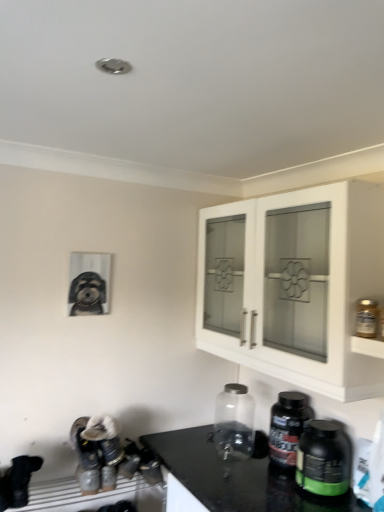
This screenshot has height=512, width=384. Describe the element at coordinates (323, 459) in the screenshot. I see `green matte protein powder container at lower right, the 3th bottle in the back-to-front sequence` at that location.

Image resolution: width=384 pixels, height=512 pixels. In order to click on white glass cabinet at upper right in this screenshot , I will do pyautogui.click(x=307, y=289).

Which is farther, (366,320) or (83,301)?

The point (83,301) is behind.

Who is more distant, clear glass jar at upper right, the 1th bottle positioned from the front, or matte black dog at left?

matte black dog at left.

Locate an element on the screen. dog located on the left of clear glass jar at upper right, the 1th bottle positioned from the front is located at coordinates (87, 294).

Is matte black dog at left surrounded by clear glass jar at upper right, placed as the fourth bottle when sorted from back to front?

No, matte black dog at left is not surrounded by clear glass jar at upper right, placed as the fourth bottle when sorted from back to front.

Would you consider green matte protein powder container at lower right, the 3th bottle in the back-to-front sequence, to be distant from clear glass jar at upper right, placed as the fourth bottle when sorted from back to front?

No.

Does green matte protein powder container at lower right, the 3th bottle in the back-to-front sequence, have a greater height compared to clear glass jar at upper right, placed as the fourth bottle when sorted from back to front?

Yes.

This screenshot has width=384, height=512. Identify the location of bottle located in front of the green matte protein powder container at lower right, the 3th bottle in the back-to-front sequence. (366, 318).

How different are the orientations of matte black dog at left and green matte protein powder container at lower right, the 2th bottle in the front-to-back sequence, in degrees?

The angular difference between matte black dog at left and green matte protein powder container at lower right, the 2th bottle in the front-to-back sequence, is 90.5 degrees.

Which of these two, matte black dog at left or green matte protein powder container at lower right, the 2th bottle in the front-to-back sequence, stands taller?

With more height is matte black dog at left.

Consider the image. From the image's perspective, does matte black dog at left appear lower than green matte protein powder container at lower right, the 2th bottle in the front-to-back sequence?

No, from the image's perspective, matte black dog at left is not below green matte protein powder container at lower right, the 2th bottle in the front-to-back sequence.

Is matte black dog at left wider or thinner than green matte protein powder container at lower right, the 3th bottle in the back-to-front sequence?

Considering their sizes, matte black dog at left looks slimmer than green matte protein powder container at lower right, the 3th bottle in the back-to-front sequence.

Who is shorter, white glass cabinet at upper right or transparent glass jar at center, the fourth bottle viewed from the front?

Standing shorter between the two is transparent glass jar at center, the fourth bottle viewed from the front.

Looking at their sizes, would you say white glass cabinet at upper right is wider or thinner than transparent glass jar at center, the fourth bottle viewed from the front?

Clearly, white glass cabinet at upper right has more width compared to transparent glass jar at center, the fourth bottle viewed from the front.

What's the angular difference between white glass cabinet at upper right and transparent glass jar at center, acting as the 1th bottle starting from the back,'s facing directions?

There is a 1.22-degree angle between the facing directions of white glass cabinet at upper right and transparent glass jar at center, acting as the 1th bottle starting from the back.

Is white glass cabinet at upper right positioned far away from transparent glass jar at center, acting as the 1th bottle starting from the back?

That's not correct — white glass cabinet at upper right is a little close to transparent glass jar at center, acting as the 1th bottle starting from the back.

From a real-world perspective, relative to white glass cabinet at upper right, is green matte protein powder container at lower right, the 3th bottle in the back-to-front sequence, vertically above or below?

green matte protein powder container at lower right, the 3th bottle in the back-to-front sequence, is situated lower than white glass cabinet at upper right in the real world.

Who is shorter, green matte protein powder container at lower right, the 3th bottle in the back-to-front sequence, or white glass cabinet at upper right?

Standing shorter between the two is green matte protein powder container at lower right, the 3th bottle in the back-to-front sequence.

Is green matte protein powder container at lower right, the 2th bottle in the front-to-back sequence, aimed at white glass cabinet at upper right?

No, green matte protein powder container at lower right, the 2th bottle in the front-to-back sequence, is not oriented towards white glass cabinet at upper right.

Is matte black dog at left outside of white glass cabinet at upper right?

matte black dog at left is positioned outside white glass cabinet at upper right.

Does matte black dog at left have a greater width compared to white glass cabinet at upper right?

No, matte black dog at left is not wider than white glass cabinet at upper right.

Looking at this image, from their relative heights in the image, would you say matte black dog at left is taller or shorter than white glass cabinet at upper right?

Clearly, matte black dog at left is shorter compared to white glass cabinet at upper right.

Looking at this image, is the surface of transparent glass jar at center, acting as the 1th bottle starting from the back, in direct contact with clear glass jar at upper right, placed as the fourth bottle when sorted from back to front?

No, transparent glass jar at center, acting as the 1th bottle starting from the back, is not beside clear glass jar at upper right, placed as the fourth bottle when sorted from back to front.

From the picture: Which object is more forward, transparent glass jar at center, acting as the 1th bottle starting from the back, or clear glass jar at upper right, placed as the fourth bottle when sorted from back to front?

clear glass jar at upper right, placed as the fourth bottle when sorted from back to front, is in front.

Based on the photo, is transparent glass jar at center, the fourth bottle viewed from the front, positioned with its back to clear glass jar at upper right, the 1th bottle positioned from the front?

No, clear glass jar at upper right, the 1th bottle positioned from the front, is not at the back of transparent glass jar at center, the fourth bottle viewed from the front.

Locate an element on the screen. dog that is behind the clear glass jar at upper right, the 1th bottle positioned from the front is located at coordinates (87, 294).

Image resolution: width=384 pixels, height=512 pixels. In order to click on bottle located on the right of green matte protein powder container at lower right, the 2th bottle in the front-to-back sequence in this screenshot , I will do `click(366, 318)`.

Which object lies nearer to the anchor point black plastic bottle at lower right, the 3th bottle viewed from the front, matte black dog at left or green matte protein powder container at lower right, the 2th bottle in the front-to-back sequence?

green matte protein powder container at lower right, the 2th bottle in the front-to-back sequence, is positioned closer to the anchor black plastic bottle at lower right, the 3th bottle viewed from the front.

Looking at the image, which one is located further to transparent glass jar at center, the fourth bottle viewed from the front, black plastic bottle at lower right, the 2th bottle from the back, or white glass cabinet at upper right?

Among the two, white glass cabinet at upper right is located further to transparent glass jar at center, the fourth bottle viewed from the front.

Which object lies nearer to the anchor point matte black dog at left, white glass cabinet at upper right or clear glass jar at upper right, placed as the fourth bottle when sorted from back to front?

Among the two, white glass cabinet at upper right is located nearer to matte black dog at left.

Looking at the image, which one is located further to transparent glass jar at center, the fourth bottle viewed from the front, matte black dog at left or black plastic bottle at lower right, the 3th bottle viewed from the front?

The object further to transparent glass jar at center, the fourth bottle viewed from the front, is matte black dog at left.

Which object lies nearer to the anchor point black plastic bottle at lower right, the 2th bottle from the back, green matte protein powder container at lower right, the 2th bottle in the front-to-back sequence, or matte black dog at left?

green matte protein powder container at lower right, the 2th bottle in the front-to-back sequence, lies closer to black plastic bottle at lower right, the 2th bottle from the back, than the other object.

Looking at this image, which object lies nearer to the anchor point matte black dog at left, green matte protein powder container at lower right, the 2th bottle in the front-to-back sequence, or transparent glass jar at center, acting as the 1th bottle starting from the back?

transparent glass jar at center, acting as the 1th bottle starting from the back.

Based on the photo, based on their spatial positions, is matte black dog at left or clear glass jar at upper right, placed as the fourth bottle when sorted from back to front, further from transparent glass jar at center, acting as the 1th bottle starting from the back?

clear glass jar at upper right, placed as the fourth bottle when sorted from back to front, is positioned further to the anchor transparent glass jar at center, acting as the 1th bottle starting from the back.

Based on their spatial positions, is black plastic bottle at lower right, the 2th bottle from the back, or clear glass jar at upper right, the 1th bottle positioned from the front, further from matte black dog at left?

Based on the image, clear glass jar at upper right, the 1th bottle positioned from the front, appears to be further to matte black dog at left.

I want to click on bottle between green matte protein powder container at lower right, the 3th bottle in the back-to-front sequence, and transparent glass jar at center, the fourth bottle viewed from the front, along the z-axis, so click(x=287, y=426).

Identify the location of cabinetry between matte black dog at left and clear glass jar at upper right, the 1th bottle positioned from the front, in the horizontal direction. [x=307, y=289].

Find the location of `bottle situated between matte black dog at left and white glass cabinet at upper right from left to right`. bottle situated between matte black dog at left and white glass cabinet at upper right from left to right is located at coordinates (234, 423).

The height and width of the screenshot is (512, 384). What are the coordinates of `bottle between white glass cabinet at upper right and transparent glass jar at center, the fourth bottle viewed from the front, in the up-down direction` in the screenshot? It's located at (366, 318).